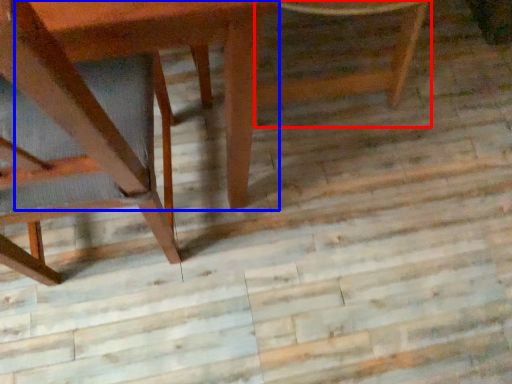
Question: Which of the following is the farthest to the observer, chair (highlighted by a red box) or round table (highlighted by a blue box)?

Choices:
 (A) chair
 (B) round table

Answer: (A)